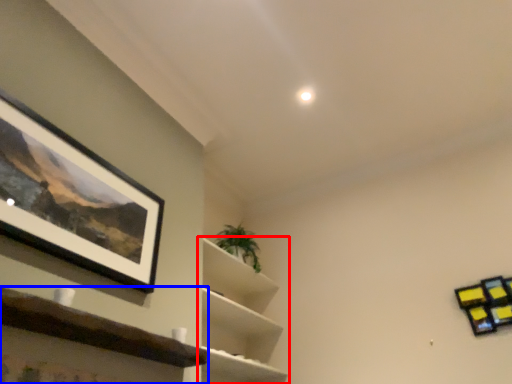
Question: Which object is closer to the camera taking this photo, shelf (highlighted by a red box) or shelf (highlighted by a blue box)?

Choices:
 (A) shelf
 (B) shelf

Answer: (B)